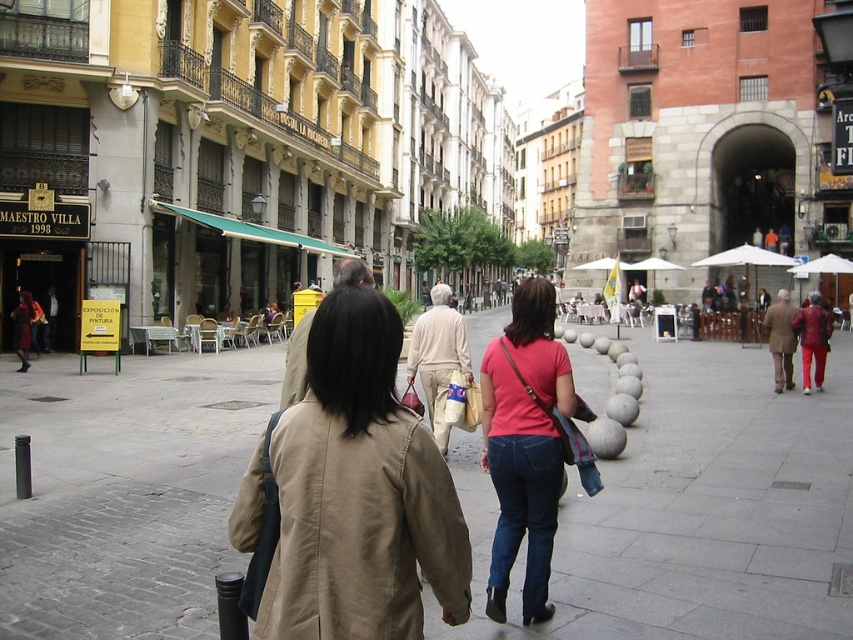
Who is positioned more to the left, gray concrete pavement at center or matte pink shirt at center?

matte pink shirt at center

Does gray concrete pavement at center come behind matte pink shirt at center?

That is True.

Is point (184, 572) in front of point (547, 470)?

That is False.

Find the location of `gray concrete pavement at center`. gray concrete pavement at center is located at coordinates (692, 509).

Between gray concrete pavement at center and tan fabric trench coat at center, which one is positioned lower?

gray concrete pavement at center

Based on the photo, does gray concrete pavement at center have a greater width compared to tan fabric trench coat at center?

Correct, the width of gray concrete pavement at center exceeds that of tan fabric trench coat at center.

Between point (509, 637) and point (341, 387), which one is positioned behind?

Positioned behind is point (509, 637).

This screenshot has width=853, height=640. Find the location of `gray concrete pavement at center`. gray concrete pavement at center is located at coordinates coord(692,509).

Is tan fabric trench coat at center below matte pink shirt at center?

Incorrect, tan fabric trench coat at center is not positioned below matte pink shirt at center.

Is tan fabric trench coat at center above matte pink shirt at center?

Indeed, tan fabric trench coat at center is positioned over matte pink shirt at center.

You are a GUI agent. You are given a task and a screenshot of the screen. Output one action in this format:
    pyautogui.click(x=<x>, y=<y>)
    Task: Click on the tan fabric trench coat at center
    This screenshot has height=640, width=853.
    Given the screenshot: What is the action you would take?
    pyautogui.click(x=358, y=492)